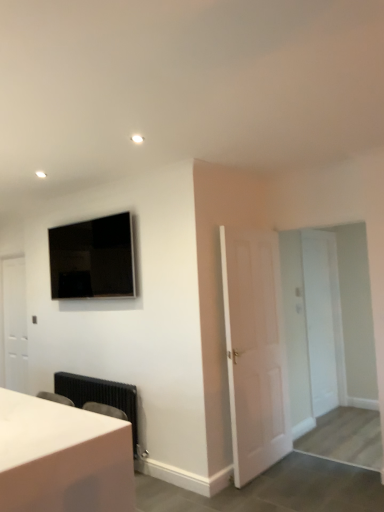
Identify the location of empty space that is ontop of flat screen tv at upper left. Image resolution: width=384 pixels, height=512 pixels. (89, 211).